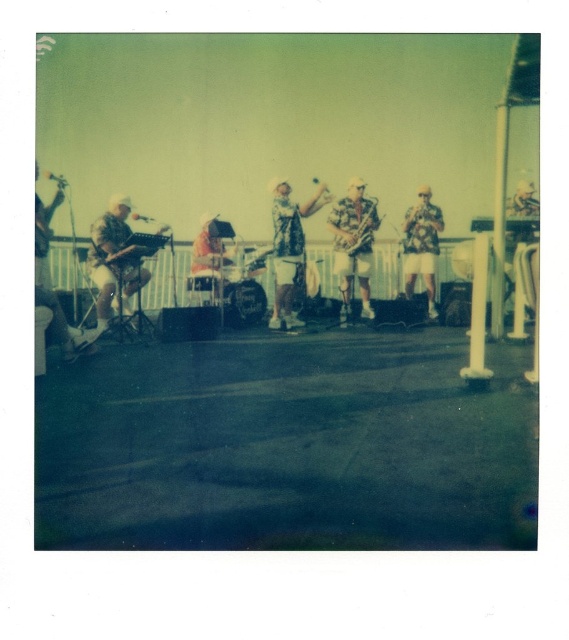
Based on the photo, you are a photographer standing at the back of the venue where the band is performing. You want to take a closeup shot of the wooden saxophone at center. Given that your camera has a maximum zoom range of 20 feet, can you capture a clear closeup without moving closer?

The wooden saxophone at center is 24.47 feet away from the viewer. Since the camera can only zoom up to 20 feet, you cannot capture a clear closeup without moving closer.